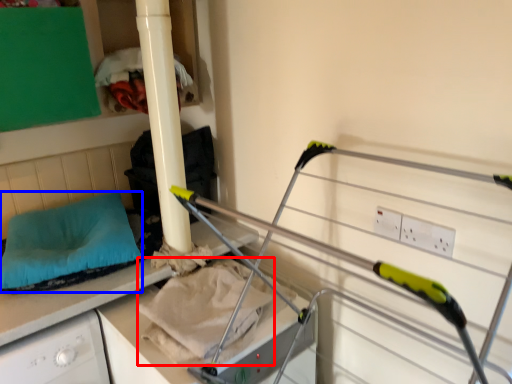
Question: Among these objects, which one is farthest to the camera, sheet (highlighted by a red box) or pillow (highlighted by a blue box)?

Choices:
 (A) sheet
 (B) pillow

Answer: (B)